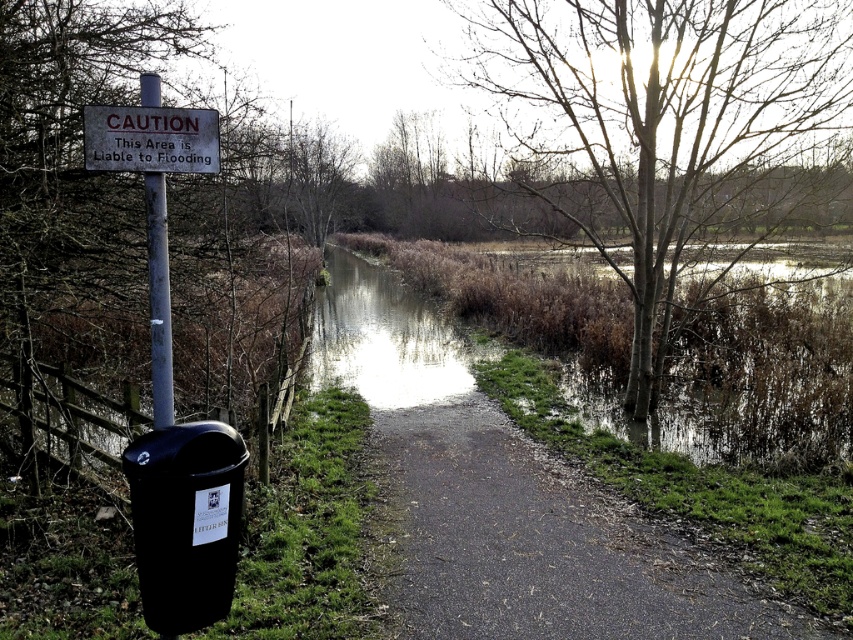
Question: Among these points, which one is farthest from the camera?

Choices:
 (A) (170, 412)
 (B) (625, 502)
 (C) (305, 170)

Answer: (C)

Question: Where is black asphalt path at center located in relation to bare branches at center in the image?

Choices:
 (A) above
 (B) below

Answer: (B)

Question: Among these objects, which one is nearest to the camera?

Choices:
 (A) black asphalt path at center
 (B) bare branches at center

Answer: (A)

Question: Is bare wood tree at upper center to the left of bare branches at center from the viewer's perspective?

Choices:
 (A) no
 (B) yes

Answer: (A)

Question: From the image, what is the correct spatial relationship of bare wood tree at upper center in relation to white plastic pole at upper left?

Choices:
 (A) right
 (B) left

Answer: (A)

Question: Which of these objects is positioned closest to the bare wood tree at upper center?

Choices:
 (A) black asphalt path at center
 (B) white plastic pole at upper left
 (C) white plastic sign at upper left
 (D) bare branches at center

Answer: (A)